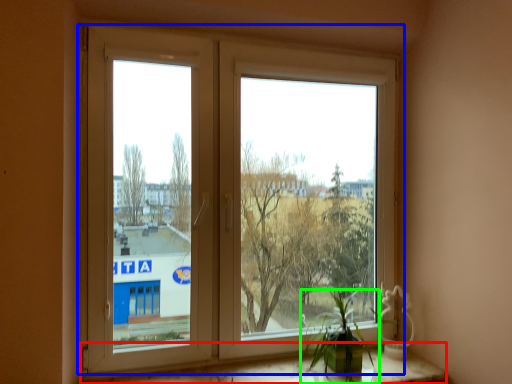
Question: Which is farther away from window sill (highlighted by a red box)? window (highlighted by a blue box) or houseplant (highlighted by a green box)?

Choices:
 (A) window
 (B) houseplant

Answer: (A)